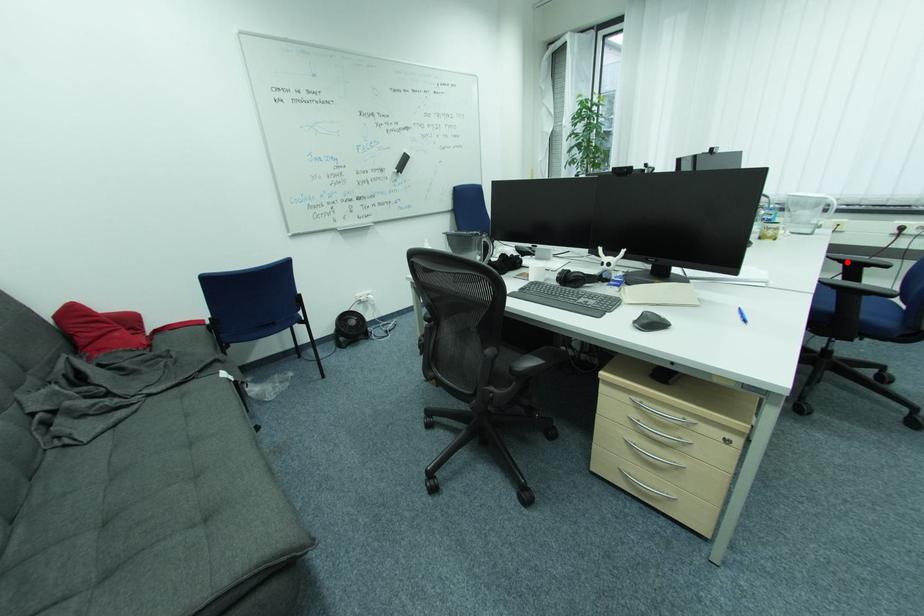
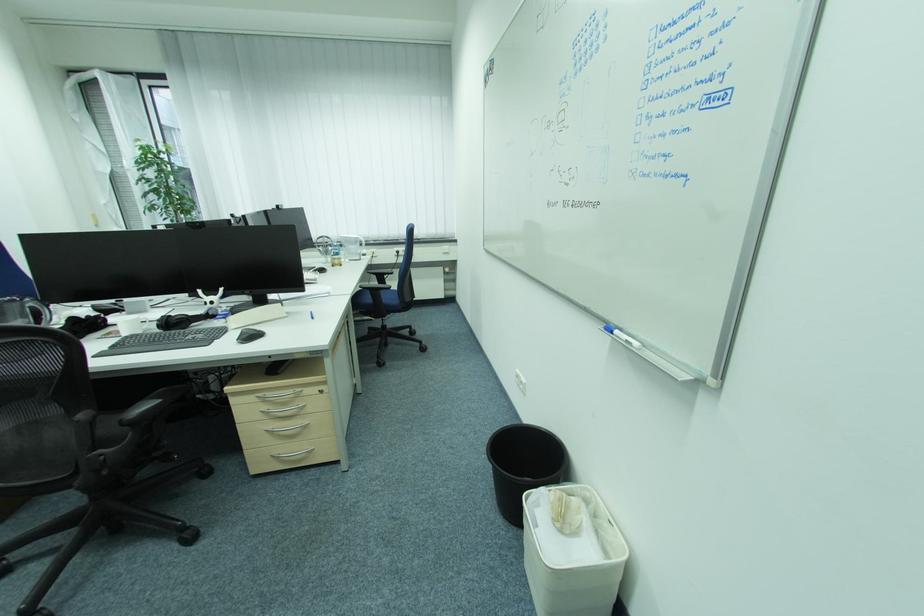
Find the pixel in the second image that matches the highlighted location in the first image.

(381, 275)